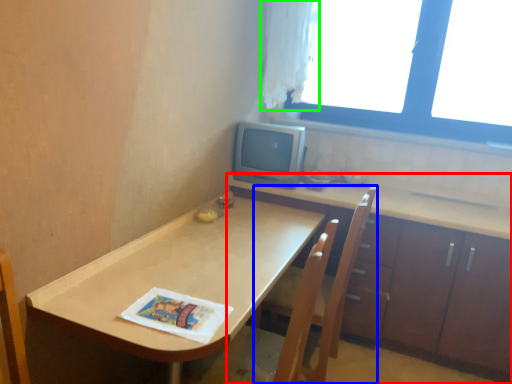
Question: Estimate the real-world distances between objects in this image. Which object is closer to cabinetry (highlighted by a red box), armchair (highlighted by a blue box) or curtain (highlighted by a green box)?

Choices:
 (A) armchair
 (B) curtain

Answer: (A)